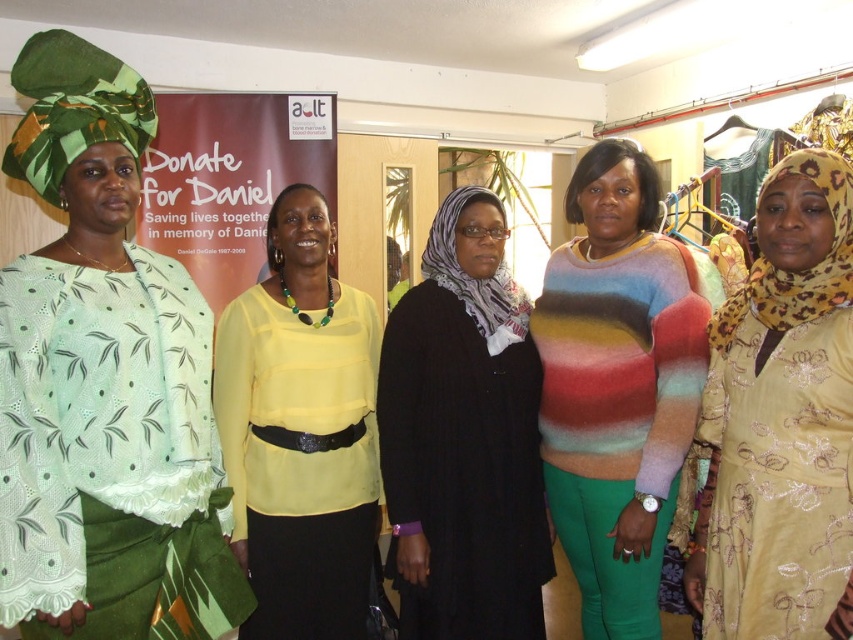
Based on the scene description, which object is wider, the matte green fabric at left or the multicolored fuzzy sweater at center?

The matte green fabric at left is wider than the multicolored fuzzy sweater at center according to the description.

You are organizing a clothing donation drive and need to pack two sweaters into boxes. The black ribbed sweater at center and the multicolored fuzzy sweater at center are both at the center of the image. Which sweater requires a larger box in terms of width?

The black ribbed sweater at center requires a larger box because its width surpasses that of the multicolored fuzzy sweater at center.